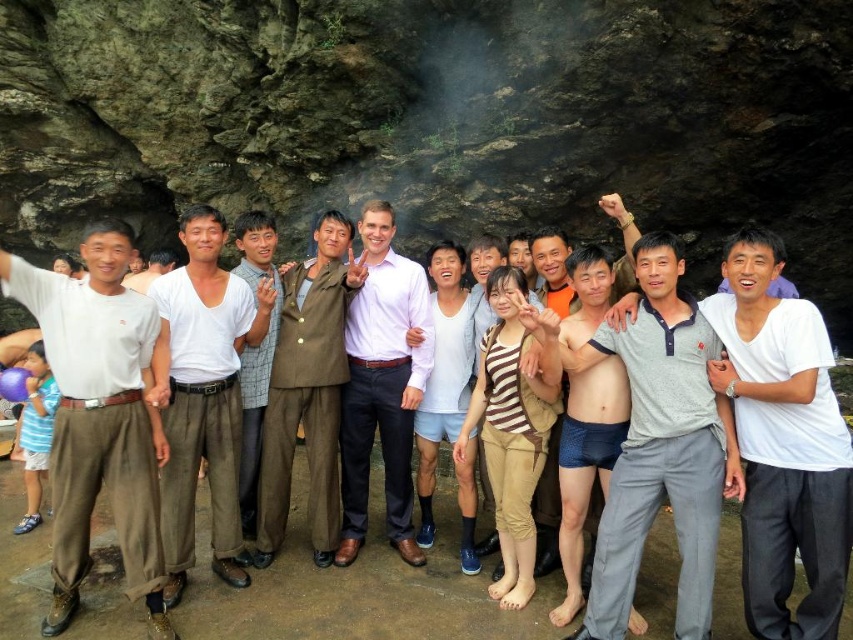
Is green fabric pants at center to the left of light brown cotton shirt at center from the viewer's perspective?

In fact, green fabric pants at center is to the right of light brown cotton shirt at center.

How distant is green fabric pants at center from light brown cotton shirt at center?

green fabric pants at center is 4.50 meters away from light brown cotton shirt at center.

Who is more forward, [247,536] or [131,280]?

Point [247,536]

The width and height of the screenshot is (853, 640). I want to click on green fabric pants at center, so click(254, 353).

Is gray cotton pants at center further to the viewer compared to light brown cotton shirt at center?

No.

You are a GUI agent. You are given a task and a screenshot of the screen. Output one action in this format:
    pyautogui.click(x=<x>, y=<y>)
    Task: Click on the gray cotton pants at center
    This screenshot has width=853, height=640.
    Given the screenshot: What is the action you would take?
    pyautogui.click(x=782, y=442)

Find the location of a particular element. The height and width of the screenshot is (640, 853). gray cotton pants at center is located at coordinates (782, 442).

Does white cotton shirt at center appear on the right side of blue fabric shorts at center?

No, white cotton shirt at center is not to the right of blue fabric shorts at center.

Describe the element at coordinates (202, 394) in the screenshot. The image size is (853, 640). I see `white cotton shirt at center` at that location.

Where is `white cotton shirt at center`? Image resolution: width=853 pixels, height=640 pixels. white cotton shirt at center is located at coordinates (202, 394).